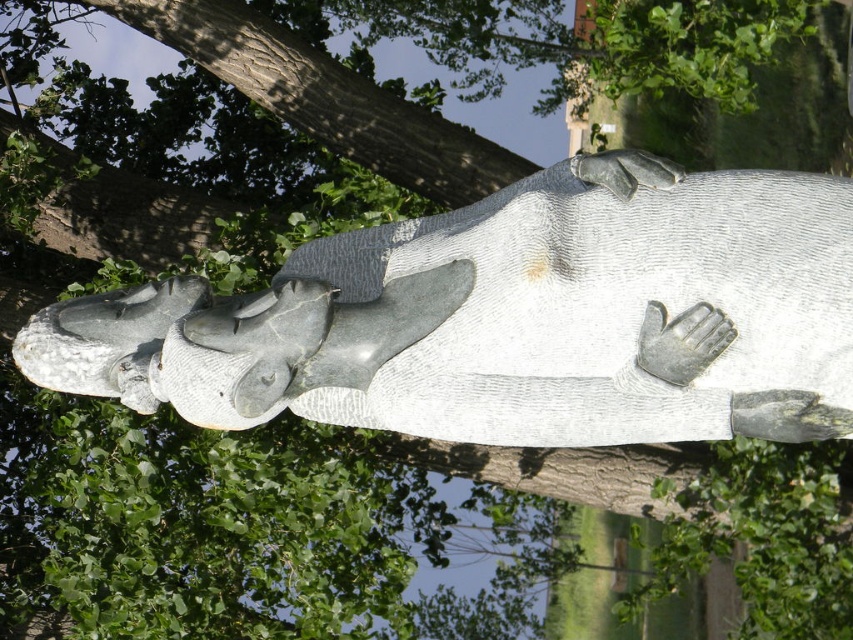
Question: Is gray stone statue at center positioned in front of silver metallic hand at center?

Choices:
 (A) no
 (B) yes

Answer: (B)

Question: Is gray stone statue at center bigger than silver metallic hand at center?

Choices:
 (A) yes
 (B) no

Answer: (A)

Question: Which object is closer to the camera taking this photo?

Choices:
 (A) silver metallic hand at center
 (B) gray stone statue at center

Answer: (B)

Question: Which object appears closest to the camera in this image?

Choices:
 (A) gray stone statue at center
 (B) silver metallic hand at center

Answer: (A)

Question: Does gray stone statue at center appear on the right side of silver metallic hand at center?

Choices:
 (A) no
 (B) yes

Answer: (A)